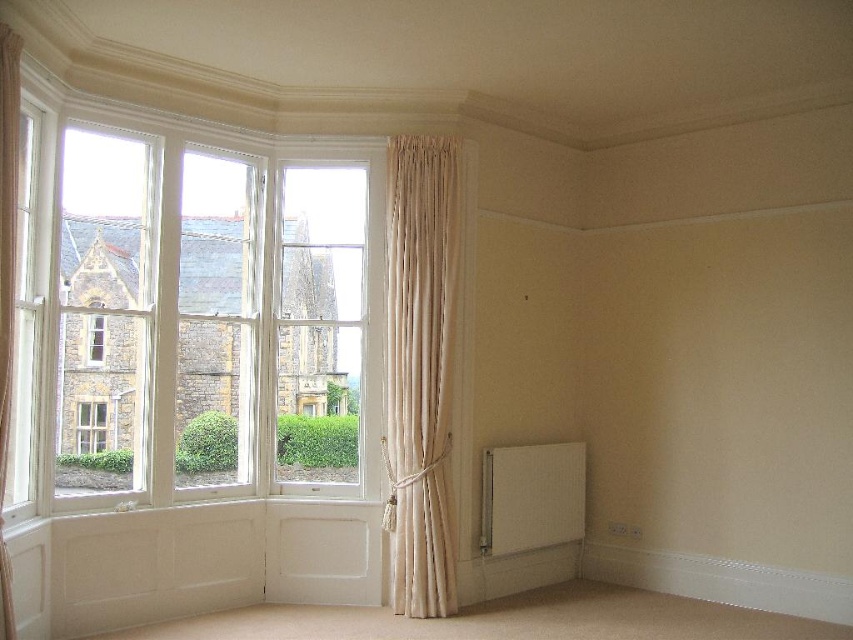
Is white matte radiator at lower right to the left of clear glass window at left from the viewer's perspective?

No, white matte radiator at lower right is not to the left of clear glass window at left.

Is white matte radiator at lower right in front of clear glass window at left?

That is False.

Identify the location of white matte radiator at lower right. (531, 497).

Which is above, beige textured curtain at left or clear glass window at left?

Positioned higher is beige textured curtain at left.

Is beige textured curtain at left below clear glass window at left?

Incorrect, beige textured curtain at left is not positioned below clear glass window at left.

Between point (4, 307) and point (91, 342), which one is positioned in front?

Point (4, 307) is in front.

You are a GUI agent. You are given a task and a screenshot of the screen. Output one action in this format:
    pyautogui.click(x=<x>, y=<y>)
    Task: Click on the beige textured curtain at left
    The height and width of the screenshot is (640, 853).
    Given the screenshot: What is the action you would take?
    pyautogui.click(x=7, y=280)

Can you confirm if white matte radiator at lower right is shorter than beige textured curtain at left?

Correct, white matte radiator at lower right is not as tall as beige textured curtain at left.

Is white matte radiator at lower right below beige textured curtain at left?

Yes, white matte radiator at lower right is below beige textured curtain at left.

Locate an element on the screen. The image size is (853, 640). white matte radiator at lower right is located at coordinates (531, 497).